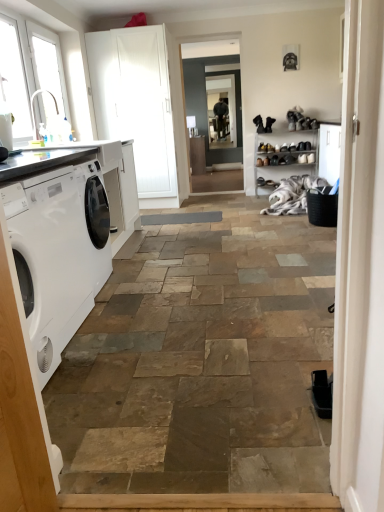
Question: Based on their positions, is white plastic window at upper left, placed as the 1th window when sorted from front to back, located to the left or right of clear glass window screen at center?

Choices:
 (A) right
 (B) left

Answer: (B)

Question: Considering the positions of white plastic window at upper left, placed as the 1th window when sorted from front to back, and clear glass window screen at center in the image, is white plastic window at upper left, placed as the 1th window when sorted from front to back, wider or thinner than clear glass window screen at center?

Choices:
 (A) thin
 (B) wide

Answer: (B)

Question: Which of these objects is positioned farthest from the white glass window at upper left, which appears as the first window when viewed from the back?

Choices:
 (A) clear glass screen door at center, the 1th screen door viewed from the right
 (B) white matte screen door at upper left, the 2th screen door from the right
 (C) white plastic window at upper left, which is the second window from back to front
 (D) black leather shoe at center
 (E) clear glass window screen at center

Answer: (E)

Question: Which object is positioned farthest from the white plastic window at upper left, which is the second window from back to front?

Choices:
 (A) clear glass screen door at center, the 2th screen door viewed from the left
 (B) white fluffy laundry at center
 (C) white glass window at upper left, which is counted as the 2th window, starting from the front
 (D) clear glass window screen at center
 (E) white matte screen door at upper left, arranged as the first screen door when viewed from the left

Answer: (D)